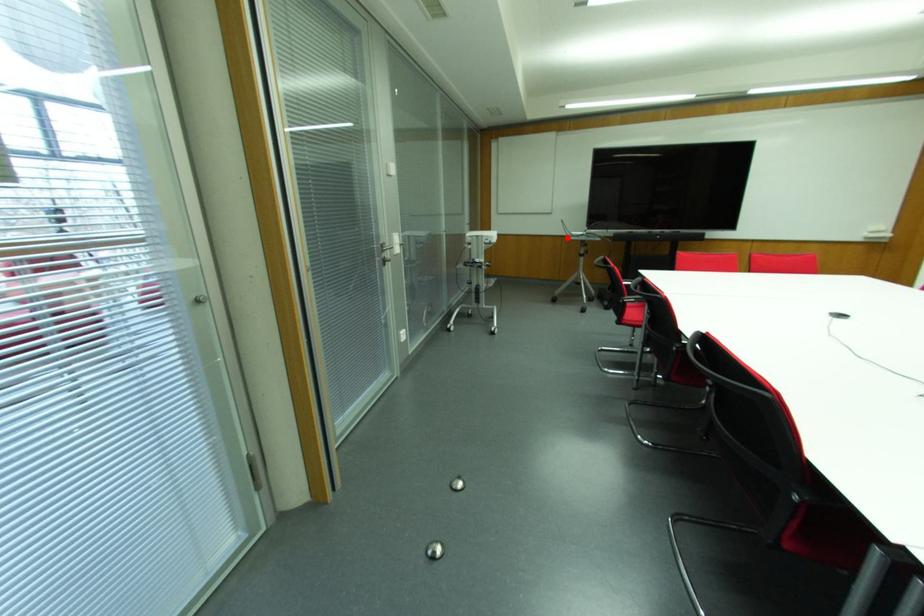
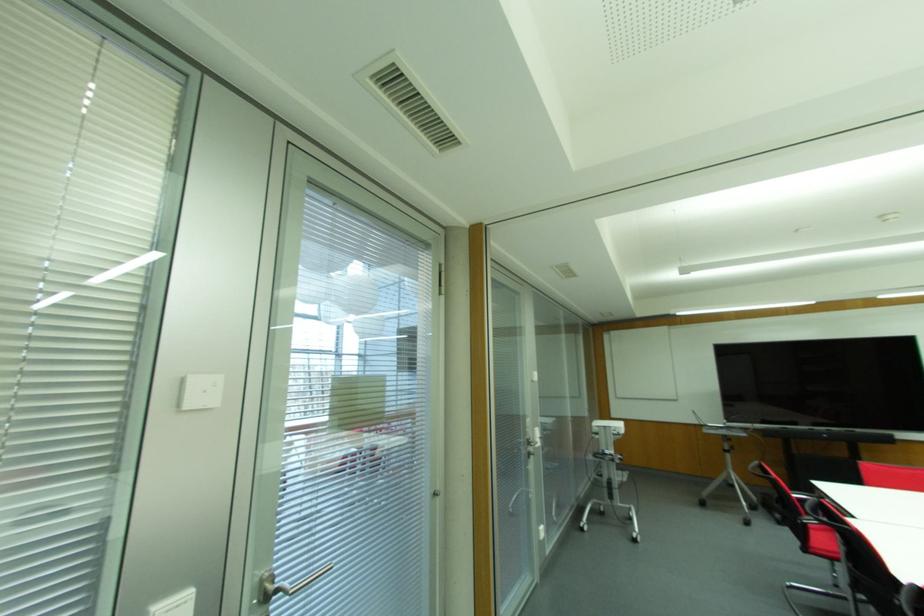
The point at the highlighted location is marked in the first image. Where is the corresponding point in the second image?

(704, 430)